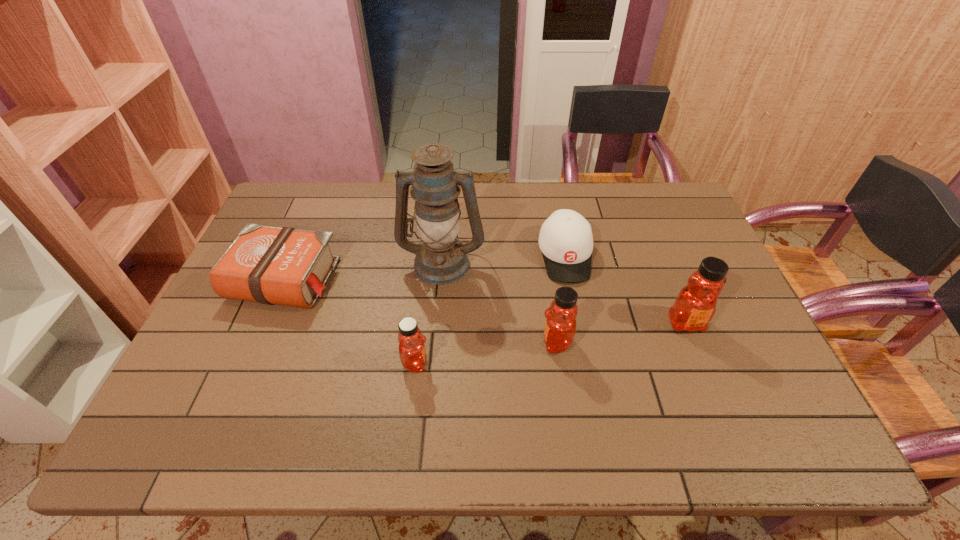
What are the coordinates of `blank space located on the front label of the fourth shortest object` in the screenshot? It's located at (504, 342).

Where is `free region located 0.350m on the front label of the fourth shortest object`? This screenshot has height=540, width=960. free region located 0.350m on the front label of the fourth shortest object is located at coordinates (400, 342).

Where is `free region located on the front label of the rightmost honey`? The width and height of the screenshot is (960, 540). free region located on the front label of the rightmost honey is located at coordinates (702, 362).

Where is `free space located 0.250m on the back of the leftmost object`? free space located 0.250m on the back of the leftmost object is located at coordinates (320, 198).

Identify the location of blank area located on the front-facing side of the baseball cap. The height and width of the screenshot is (540, 960). (585, 357).

Where is `vacant position located on the front of the tallest object`? The height and width of the screenshot is (540, 960). vacant position located on the front of the tallest object is located at coordinates (436, 337).

The image size is (960, 540). What are the coordinates of `object present at the near edge` in the screenshot? It's located at (412, 351).

This screenshot has height=540, width=960. What are the coordinates of `object that is at the left edge` in the screenshot? It's located at (286, 266).

This screenshot has width=960, height=540. What are the coordinates of `object present at the right edge` in the screenshot? It's located at (695, 305).

Identify the location of free space at the far edge. The image size is (960, 540). (610, 201).